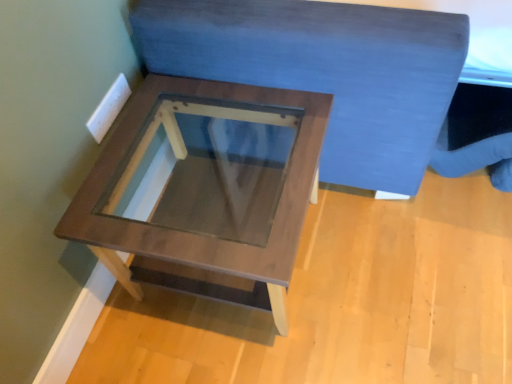
Question: From the image's perspective, is velvet blue bedding at upper center under wooden table at center?

Choices:
 (A) yes
 (B) no

Answer: (B)

Question: Does velvet blue bedding at upper center appear on the left side of wooden table at center?

Choices:
 (A) yes
 (B) no

Answer: (B)

Question: Is velvet blue bedding at upper center shorter than wooden table at center?

Choices:
 (A) no
 (B) yes

Answer: (A)

Question: Is there a large distance between velvet blue bedding at upper center and wooden table at center?

Choices:
 (A) no
 (B) yes

Answer: (A)

Question: Is velvet blue bedding at upper center not within wooden table at center?

Choices:
 (A) no
 (B) yes

Answer: (B)

Question: Considering the relative sizes of velvet blue bedding at upper center and wooden table at center in the image provided, is velvet blue bedding at upper center thinner than wooden table at center?

Choices:
 (A) no
 (B) yes

Answer: (A)

Question: Can you confirm if wooden table at center is smaller than velvet blue bedding at upper center?

Choices:
 (A) no
 (B) yes

Answer: (B)

Question: Considering the relative positions of wooden table at center and velvet blue bedding at upper center in the image provided, is wooden table at center behind velvet blue bedding at upper center?

Choices:
 (A) yes
 (B) no

Answer: (A)

Question: Can you confirm if wooden table at center is thinner than velvet blue bedding at upper center?

Choices:
 (A) no
 (B) yes

Answer: (B)

Question: From a real-world perspective, is wooden table at center located beneath velvet blue bedding at upper center?

Choices:
 (A) no
 (B) yes

Answer: (B)

Question: Is wooden table at center to the left of velvet blue bedding at upper center from the viewer's perspective?

Choices:
 (A) no
 (B) yes

Answer: (B)

Question: Is wooden table at center wider than velvet blue bedding at upper center?

Choices:
 (A) no
 (B) yes

Answer: (A)

Question: In the image, is wooden table at center on the left side or the right side of velvet blue bedding at upper center?

Choices:
 (A) right
 (B) left

Answer: (B)